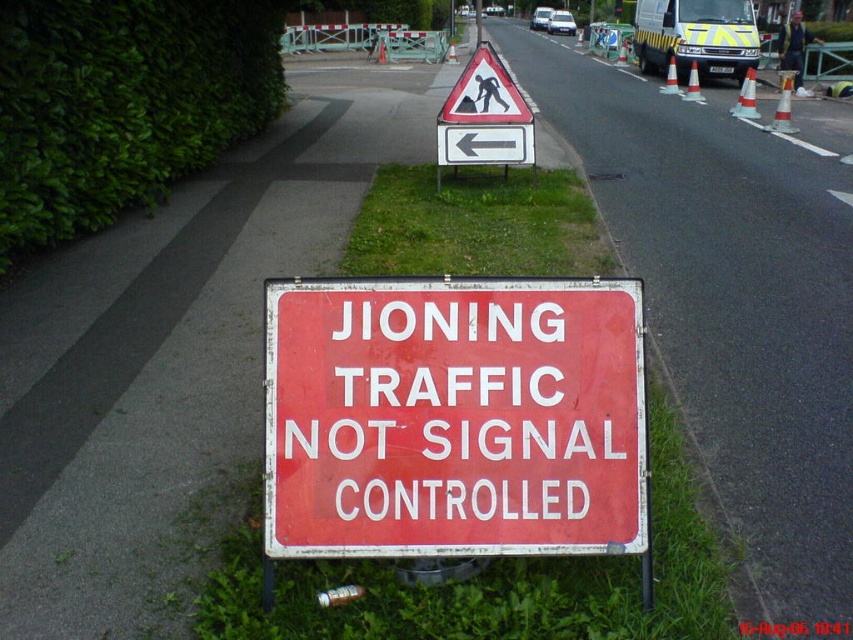
Question: Is green leafy hedge at left bigger than yellow striped van at upper center?

Choices:
 (A) yes
 (B) no

Answer: (B)

Question: Does yellow striped van at upper center lie behind white plastic sign at upper center?

Choices:
 (A) no
 (B) yes

Answer: (B)

Question: Estimate the real-world distances between objects in this image. Which object is closer to the white plastic sign at upper center?

Choices:
 (A) yellow striped van at upper center
 (B) green grass at lower center
 (C) red metal sign at center

Answer: (C)

Question: Which point appears farthest from the camera in this image?

Choices:
 (A) (521, 264)
 (B) (645, 45)

Answer: (B)

Question: Which object is positioned farthest from the green grass at lower center?

Choices:
 (A) yellow striped van at upper center
 (B) white plastic sign at upper center
 (C) green leafy hedge at left

Answer: (A)

Question: Is yellow striped van at upper center bigger than white plastic sign at upper center?

Choices:
 (A) yes
 (B) no

Answer: (A)